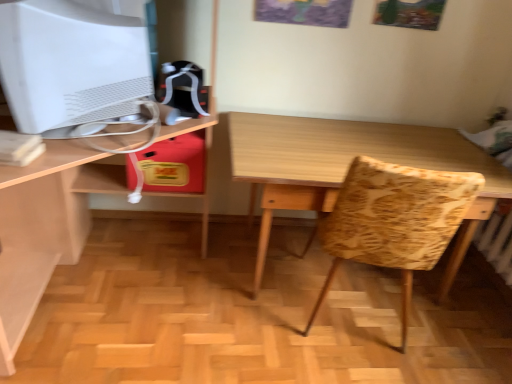
Image resolution: width=512 pixels, height=384 pixels. Identify the location of free point to the right of patterned fabric swivel chair at center. (462, 336).